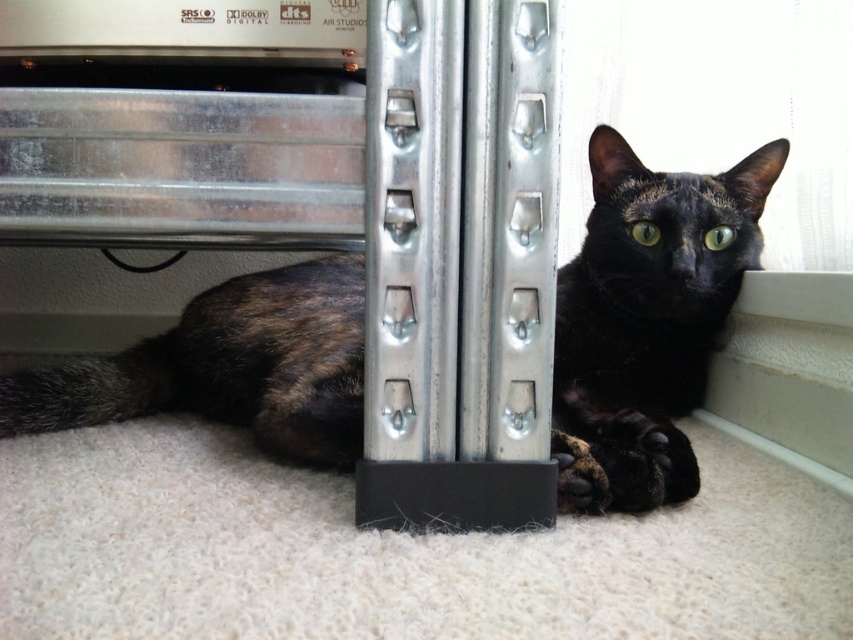
Question: Which point is farther to the camera?

Choices:
 (A) (604, 477)
 (B) (651, 419)

Answer: (B)

Question: Is tortoiseshell fur cat at lower center above black fur at lower center?

Choices:
 (A) no
 (B) yes

Answer: (B)

Question: Can you confirm if tortoiseshell fur cat at lower center is positioned above black fur at lower center?

Choices:
 (A) no
 (B) yes

Answer: (B)

Question: Which of the following is the farthest from the observer?

Choices:
 (A) pyautogui.click(x=693, y=392)
 (B) pyautogui.click(x=570, y=499)

Answer: (A)

Question: Which object is farther from the camera taking this photo?

Choices:
 (A) tortoiseshell fur cat at lower center
 (B) black fur at lower center

Answer: (A)

Question: Is tortoiseshell fur cat at lower center to the left of black fur at lower center from the viewer's perspective?

Choices:
 (A) no
 (B) yes

Answer: (A)